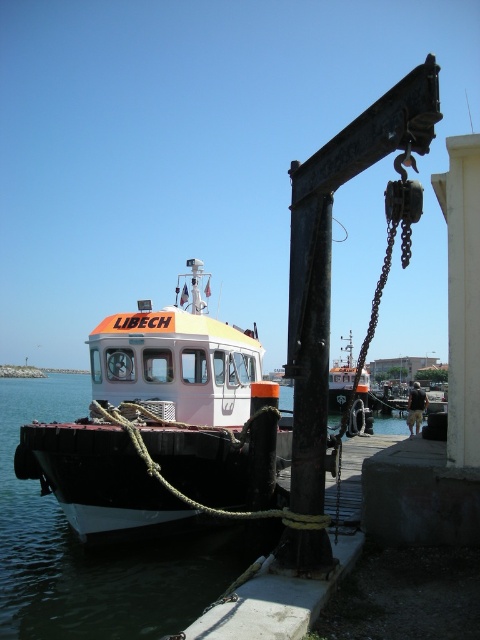
Which is behind, point (118, 506) or point (58, 554)?

The point (58, 554) is more distant.

Is white matte boat at center smaller than black rubber water at lower left?

Yes.

Where is `white matte boat at center`? This screenshot has height=640, width=480. white matte boat at center is located at coordinates (181, 388).

Between black rubber water at lower left and orange matte boat at center, which one appears on the left side from the viewer's perspective?

Positioned to the left is black rubber water at lower left.

Does black rubber water at lower left appear over orange matte boat at center?

Actually, black rubber water at lower left is below orange matte boat at center.

Find the location of a particular element. black rubber water at lower left is located at coordinates (92, 548).

Which is behind, point (192, 346) or point (348, 355)?

The point (348, 355) is more distant.

Who is taller, white matte boat at center or orange matte boat at center?

orange matte boat at center

You are a GUI agent. You are given a task and a screenshot of the screen. Output one action in this format:
    pyautogui.click(x=<x>, y=<y>)
    Task: Click on the white matte boat at center
    
    Given the screenshot: What is the action you would take?
    pyautogui.click(x=181, y=388)